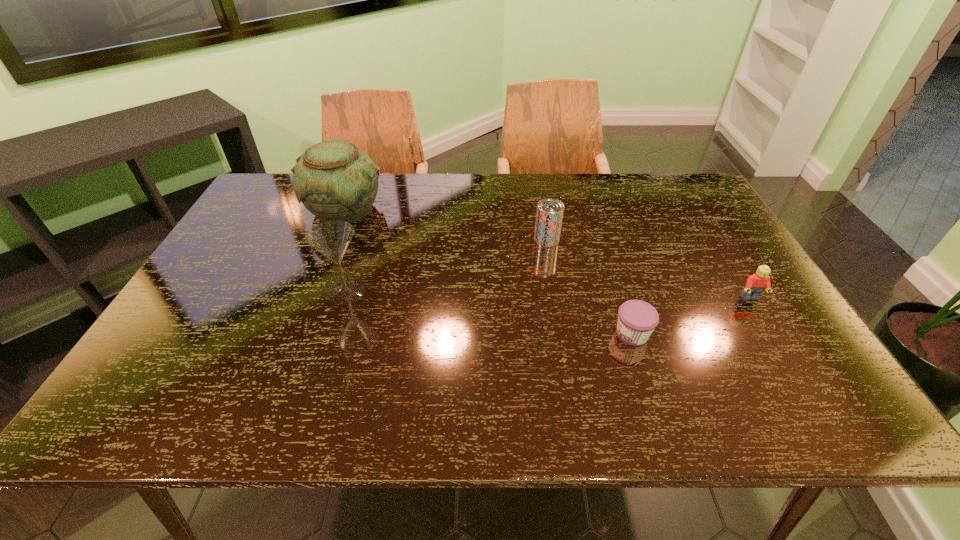
Identify the location of free space between the flute glass and the beer can. Image resolution: width=960 pixels, height=540 pixels. (446, 265).

Locate an element on the screen. This screenshot has width=960, height=540. vacant area that lies between the flute glass and the third object from right to left is located at coordinates (446, 265).

Identify the location of free spot between the beer can and the shortest object. This screenshot has height=540, width=960. (589, 287).

Identify the location of free area in between the pottery and the third object from right to left. (446, 224).

This screenshot has height=540, width=960. I want to click on empty space between the jam and the flute glass, so click(x=489, y=313).

This screenshot has height=540, width=960. Find the location of `vacant space in between the rightmost object and the pottery`. vacant space in between the rightmost object and the pottery is located at coordinates (547, 254).

You are a GUI agent. You are given a task and a screenshot of the screen. Output one action in this format:
    pyautogui.click(x=<x>, y=<y>)
    Task: Click on the free point between the pottery and the third object from left to right
    The image size is (960, 540).
    Given the screenshot: What is the action you would take?
    pyautogui.click(x=446, y=224)

Locate an element on the screen. The width and height of the screenshot is (960, 540). vacant space in between the third object from left to right and the Lego is located at coordinates (648, 269).

You are a GUI agent. You are given a task and a screenshot of the screen. Output one action in this format:
    pyautogui.click(x=<x>, y=<y>)
    Task: Click on the third closest object to the nearest object
    
    Given the screenshot: What is the action you would take?
    pyautogui.click(x=331, y=238)

This screenshot has height=540, width=960. I want to click on object that ranks as the third closest to the jam, so click(x=331, y=238).